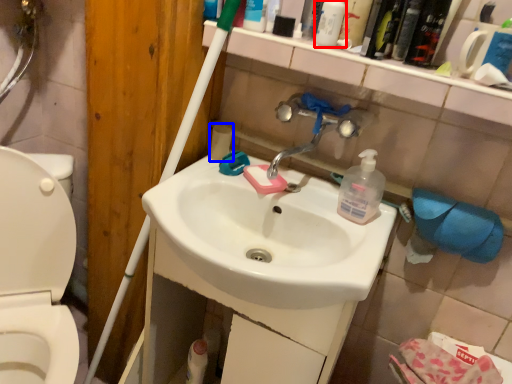
Question: Among these objects, which one is farthest to the camera, cleaning product (highlighted by a red box) or toilet paper (highlighted by a blue box)?

Choices:
 (A) cleaning product
 (B) toilet paper

Answer: (B)